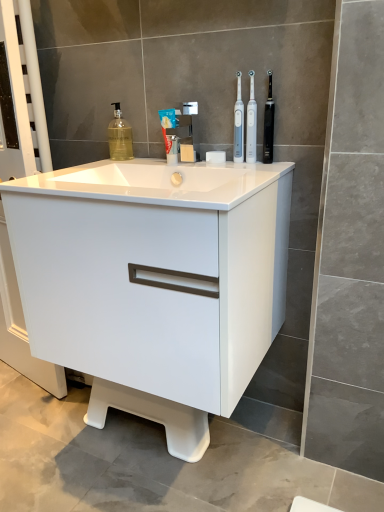
This screenshot has height=512, width=384. I want to click on vacant space in front of white plastic toothbrush at center, the first toothbrush from the left, so click(262, 168).